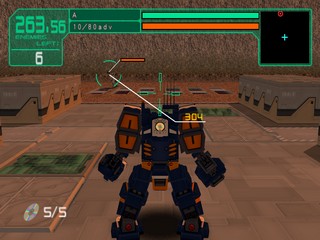
I want to click on the back wall, so click(173, 53).